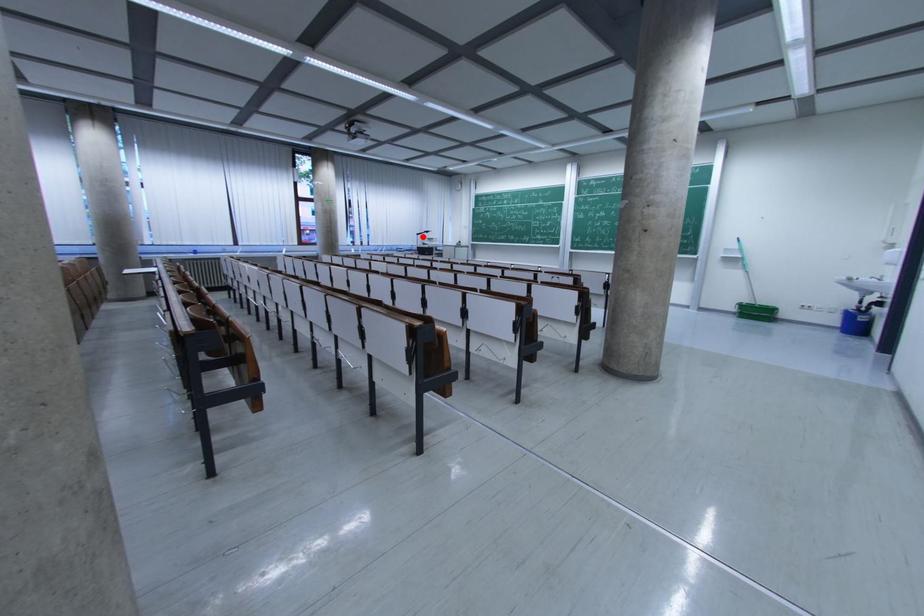
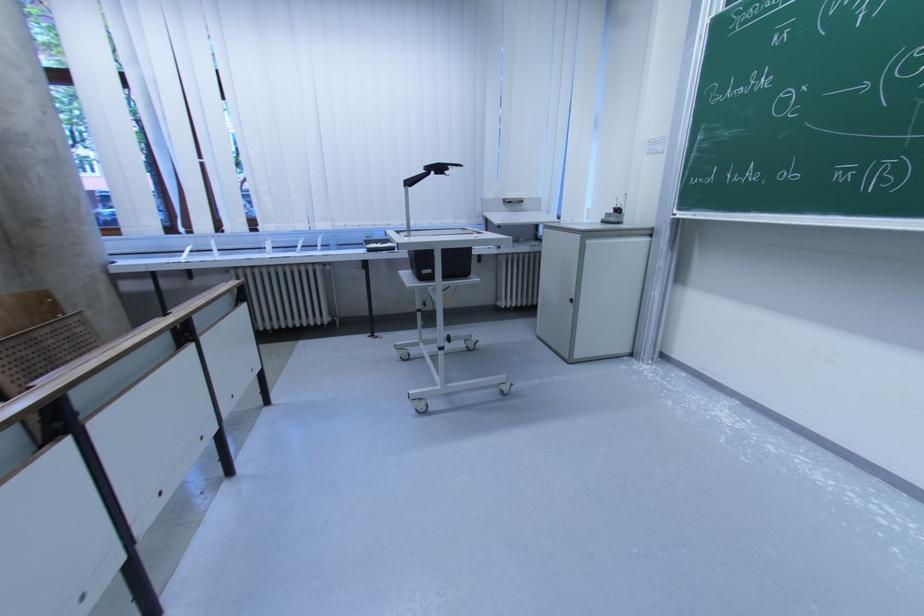
Find the pixel in the second image that matches the highlighted location in the first image.

(415, 185)